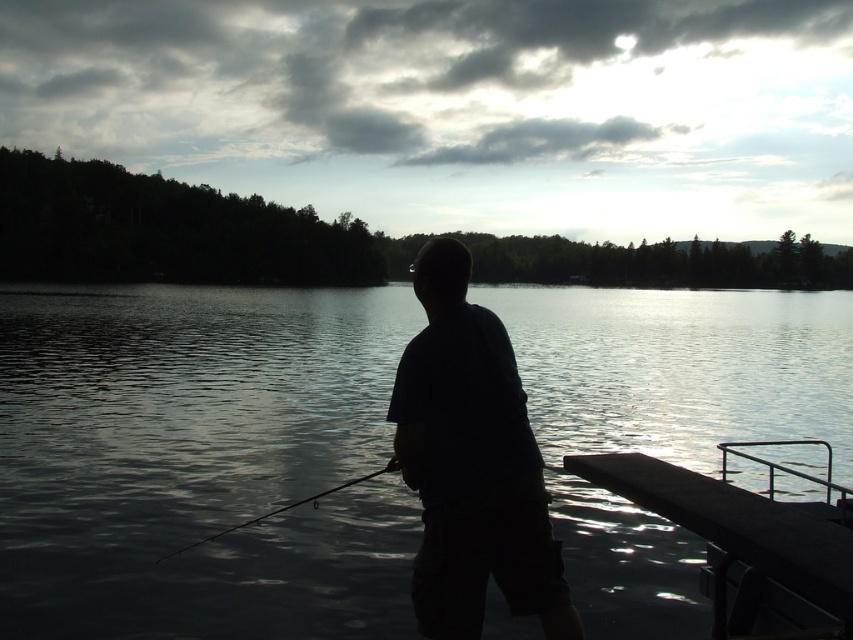
Question: Which object is positioned farthest from the dark blue shirt at center?

Choices:
 (A) transparent water at center
 (B) smooth wood dock at lower right
 (C) silvery metallic fishing pole at lower center

Answer: (A)

Question: Which point is closer to the camera?

Choices:
 (A) silvery metallic fishing pole at lower center
 (B) smooth wood dock at lower right

Answer: (A)

Question: Can you confirm if dark blue shirt at center is thinner than smooth wood dock at lower right?

Choices:
 (A) no
 (B) yes

Answer: (B)

Question: Is dark blue shirt at center bigger than smooth wood dock at lower right?

Choices:
 (A) yes
 (B) no

Answer: (B)

Question: Does transparent water at center lie behind silvery metallic fishing pole at lower center?

Choices:
 (A) no
 (B) yes

Answer: (A)

Question: Estimate the real-world distances between objects in this image. Which object is closer to the smooth wood dock at lower right?

Choices:
 (A) transparent water at center
 (B) dark blue shirt at center
 (C) silvery metallic fishing pole at lower center

Answer: (B)